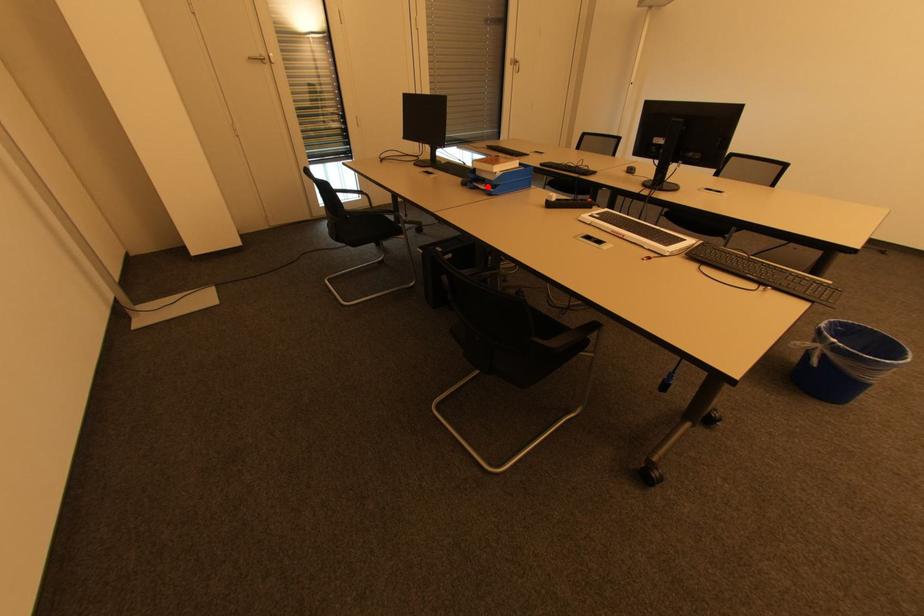
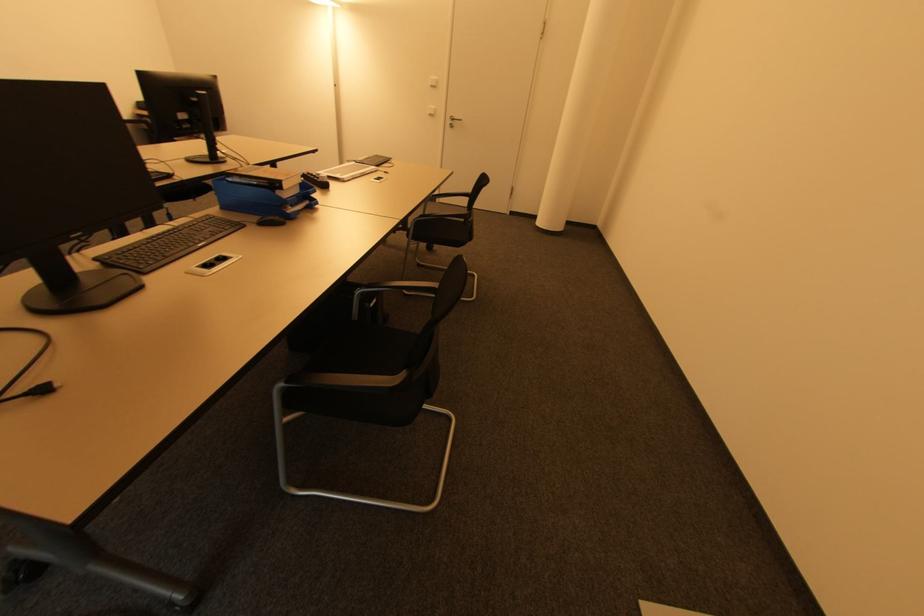
In the second image, find the point that corresponds to the highlighted location in the first image.

(294, 207)